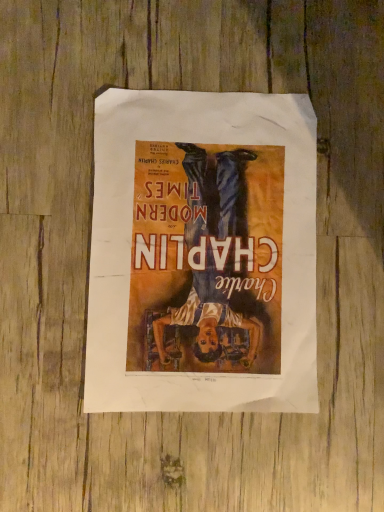
Where is `free space above matte paper poster at center (from a real-world perspective)`? The height and width of the screenshot is (512, 384). free space above matte paper poster at center (from a real-world perspective) is located at coordinates (201, 248).